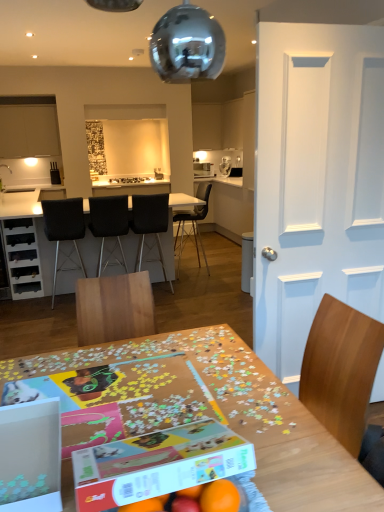
You are a GUI agent. You are given a task and a screenshot of the screen. Output one action in this format:
    pyautogui.click(x=<x>, y=<y>)
    Task: Click on the vacant area on top of wooden puzzle table at center, arranged as the 2th table when viewed from the back (from a real-world perspective)
    
    Given the screenshot: What is the action you would take?
    pyautogui.click(x=147, y=391)